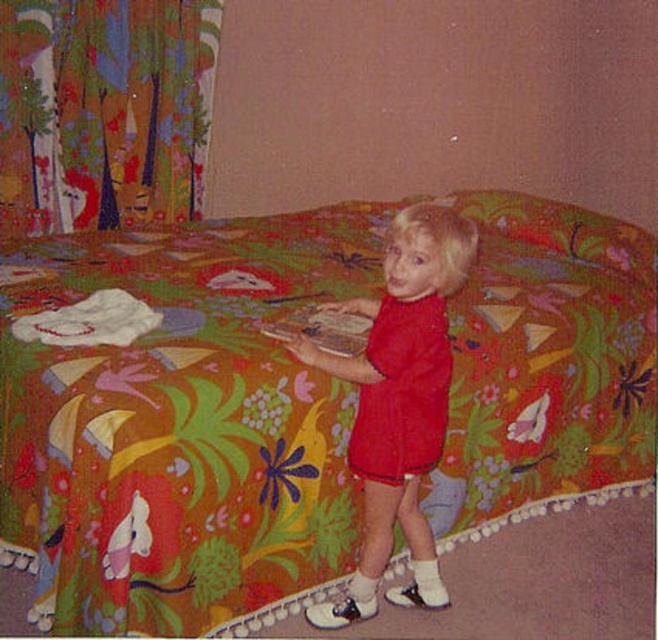
Question: Which of the following is the farthest from the observer?

Choices:
 (A) (499, 385)
 (B) (422, 424)

Answer: (A)

Question: Considering the real-world distances, which object is farthest from the matte red dress at center?

Choices:
 (A) multicolored fabric curtain at upper left
 (B) floral fabric bed at center

Answer: (A)

Question: Considering the relative positions of floral fabric bed at center and matte red dress at center in the image provided, where is floral fabric bed at center located with respect to matte red dress at center?

Choices:
 (A) below
 (B) above

Answer: (B)

Question: Observing the image, what is the correct spatial positioning of floral fabric bed at center in reference to matte red dress at center?

Choices:
 (A) right
 (B) left

Answer: (B)

Question: Which point is farther to the camera?

Choices:
 (A) (161, 51)
 (B) (443, 372)

Answer: (A)

Question: In this image, where is floral fabric bed at center located relative to matte red dress at center?

Choices:
 (A) below
 (B) above

Answer: (B)